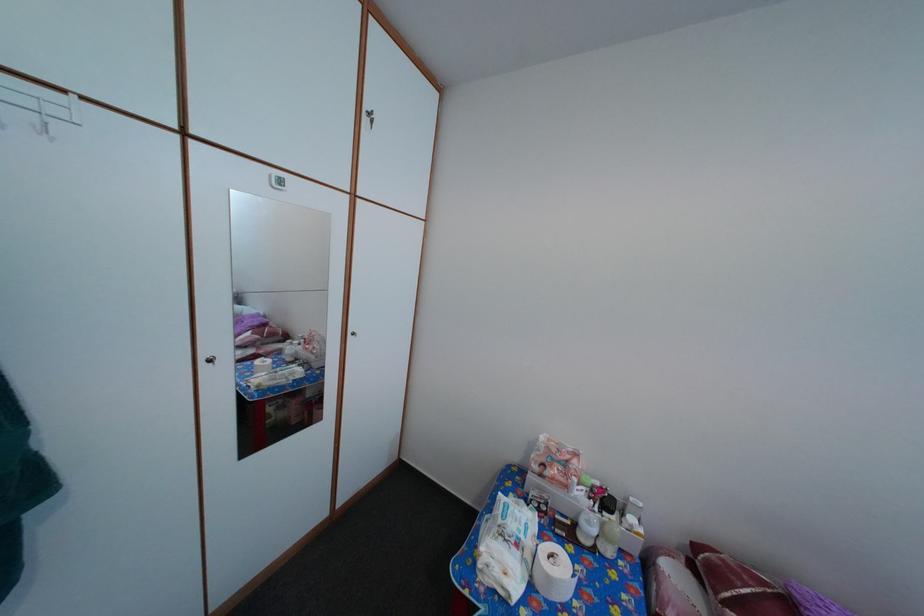
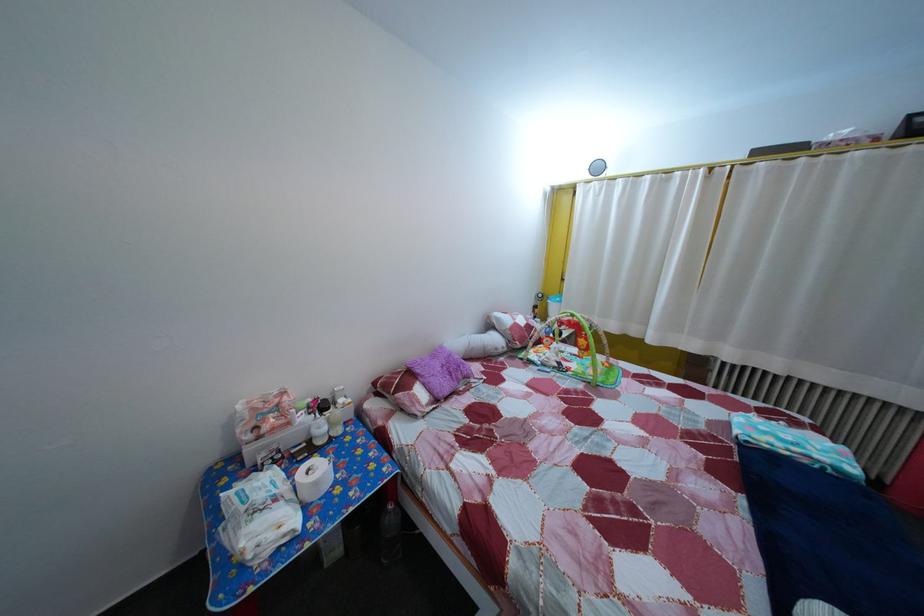
Find the pixel in the second image that matches point 589,503 in the first image.

(311, 427)